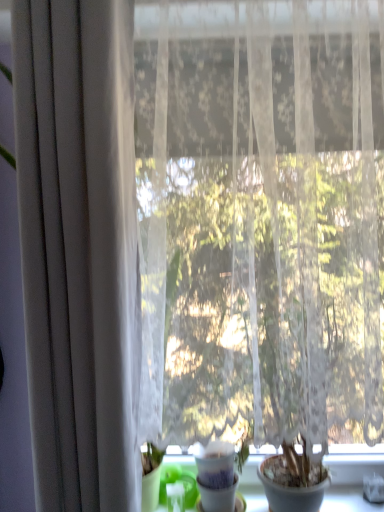
Question: Is green plastic at lower left wider or thinner than matte white flowerpot at lower right?

Choices:
 (A) thin
 (B) wide

Answer: (A)

Question: From a real-world perspective, is green plastic at lower left above or below matte white flowerpot at lower right?

Choices:
 (A) below
 (B) above

Answer: (A)

Question: Which is nearer to the white matte pot at center?

Choices:
 (A) matte gray curtain at left
 (B) matte white flowerpot at lower right
 (C) green plastic at lower left

Answer: (B)

Question: Which is farther from the matte white flowerpot at lower right?

Choices:
 (A) white matte pot at center
 (B) green plastic at lower left
 (C) matte gray curtain at left

Answer: (C)